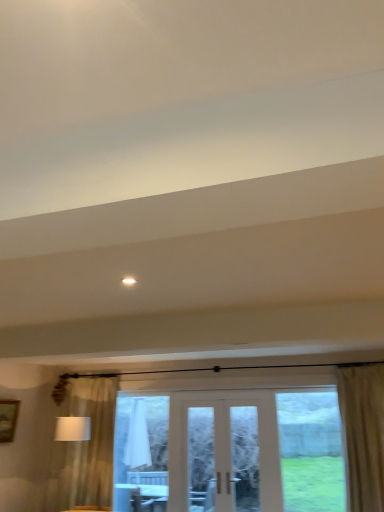
Question: Does beige textured curtain at right have a greater height compared to clear glass door at center?

Choices:
 (A) yes
 (B) no

Answer: (A)

Question: From the image's perspective, is beige textured curtain at right beneath clear glass door at center?

Choices:
 (A) yes
 (B) no

Answer: (B)

Question: Is the surface of beige textured curtain at right in direct contact with clear glass door at center?

Choices:
 (A) no
 (B) yes

Answer: (A)

Question: Would you say beige textured curtain at right is a long distance from clear glass door at center?

Choices:
 (A) yes
 (B) no

Answer: (A)

Question: Is beige textured curtain at right positioned in front of clear glass door at center?

Choices:
 (A) yes
 (B) no

Answer: (A)

Question: Is beige textured curtain at right smaller than clear glass door at center?

Choices:
 (A) no
 (B) yes

Answer: (A)

Question: Considering the relative positions of clear glass door at center and wooden picture frame at left in the image provided, is clear glass door at center to the left of wooden picture frame at left from the viewer's perspective?

Choices:
 (A) yes
 (B) no

Answer: (B)

Question: Considering the relative sizes of clear glass door at center and wooden picture frame at left in the image provided, is clear glass door at center shorter than wooden picture frame at left?

Choices:
 (A) yes
 (B) no

Answer: (B)

Question: Is clear glass door at center to the right of wooden picture frame at left from the viewer's perspective?

Choices:
 (A) yes
 (B) no

Answer: (A)

Question: Considering the relative positions of clear glass door at center and wooden picture frame at left in the image provided, is clear glass door at center behind wooden picture frame at left?

Choices:
 (A) no
 (B) yes

Answer: (A)

Question: Considering the relative positions of clear glass door at center and wooden picture frame at left in the image provided, is clear glass door at center in front of wooden picture frame at left?

Choices:
 (A) no
 (B) yes

Answer: (B)

Question: Are clear glass door at center and wooden picture frame at left beside each other?

Choices:
 (A) no
 (B) yes

Answer: (A)

Question: Does clear glass door at center contain beige textured curtain at right?

Choices:
 (A) no
 (B) yes

Answer: (A)